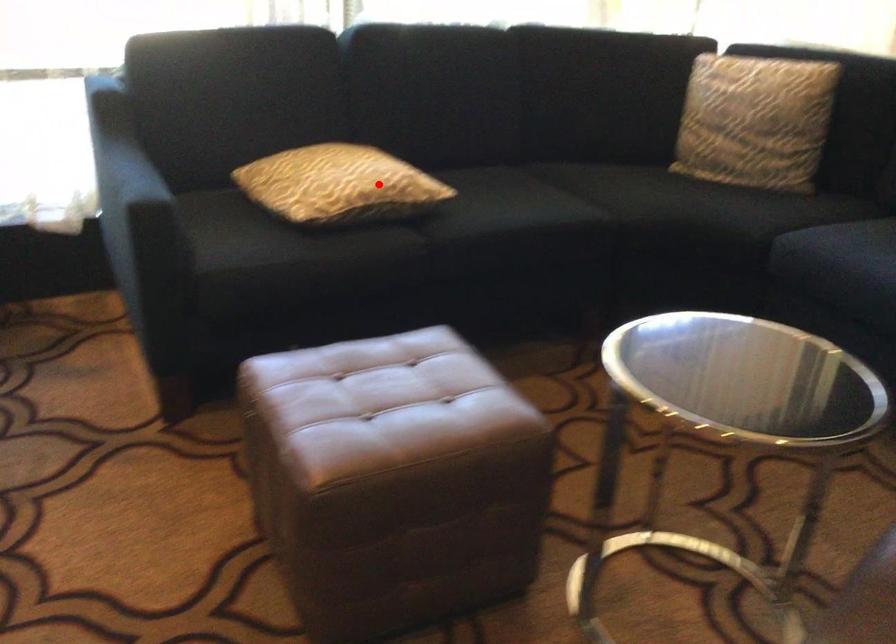
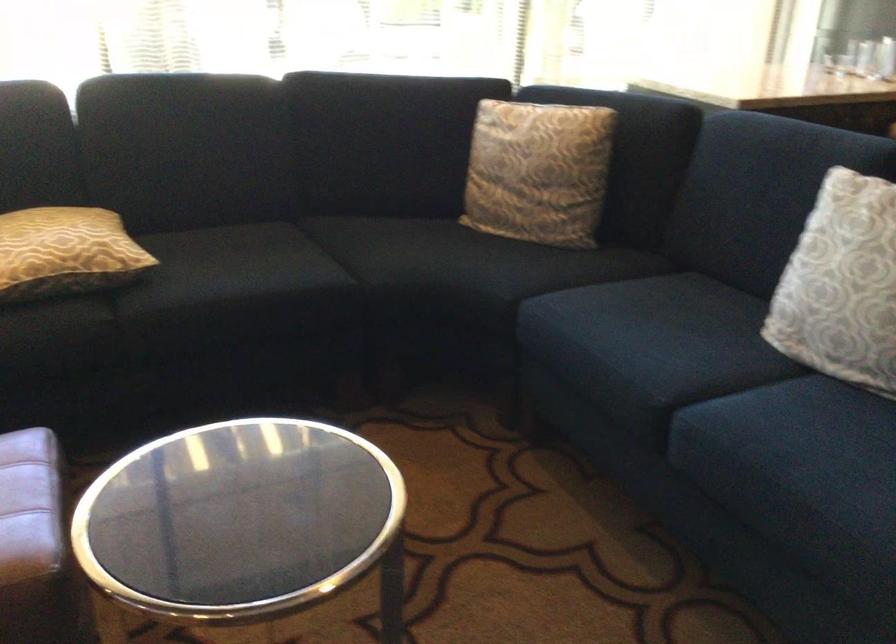
Question: I am providing you with two images of the same scene from different viewpoints. Image1 has a red point marked. In image2, the corresponding 3D location appears at what relative position? Reply with the corresponding letter.

Choices:
 (A) Closer
 (B) Farther

Answer: (A)